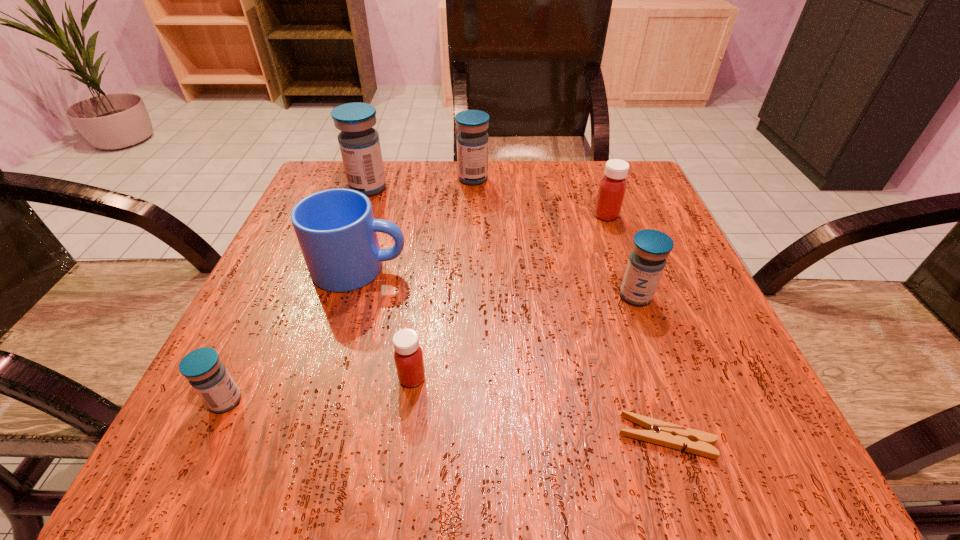
Image resolution: width=960 pixels, height=540 pixels. I want to click on free region located 0.260m on the back of the fifth object from right to left, so click(x=429, y=253).

Where is `vacant position located 0.270m on the back of the leftmost medicine`? vacant position located 0.270m on the back of the leftmost medicine is located at coordinates (292, 262).

The width and height of the screenshot is (960, 540). I want to click on vacant region located 0.240m on the back of the clothespin, so click(618, 290).

The height and width of the screenshot is (540, 960). I want to click on medicine that is at the near edge, so [209, 377].

You are a GUI agent. You are given a task and a screenshot of the screen. Output one action in this format:
    pyautogui.click(x=<x>, y=<y>)
    Task: Click on the clothespin located in the near edge section of the desktop
    
    Given the screenshot: What is the action you would take?
    pyautogui.click(x=662, y=433)

Image resolution: width=960 pixels, height=540 pixels. Find the location of `mug located at the left edge`. mug located at the left edge is located at coordinates click(x=337, y=232).

Identify the location of clothespin present at the right edge. The height and width of the screenshot is (540, 960). (662, 433).

Find the location of a particular element. This screenshot has width=960, height=540. object that is at the far left corner is located at coordinates (359, 143).

Image resolution: width=960 pixels, height=540 pixels. I want to click on object that is at the near left corner, so click(209, 377).

Identify the location of object positioned at the far right corner. This screenshot has height=540, width=960. (612, 188).